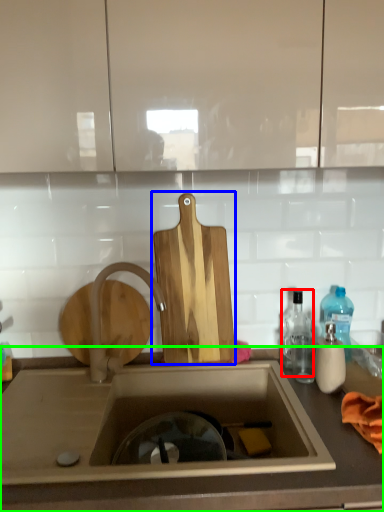
Question: Which object is positioned farthest from bottle (highlighted by a red box)? Select from cutting board (highlighted by a blue box) and countertop (highlighted by a green box).

Choices:
 (A) cutting board
 (B) countertop

Answer: (B)